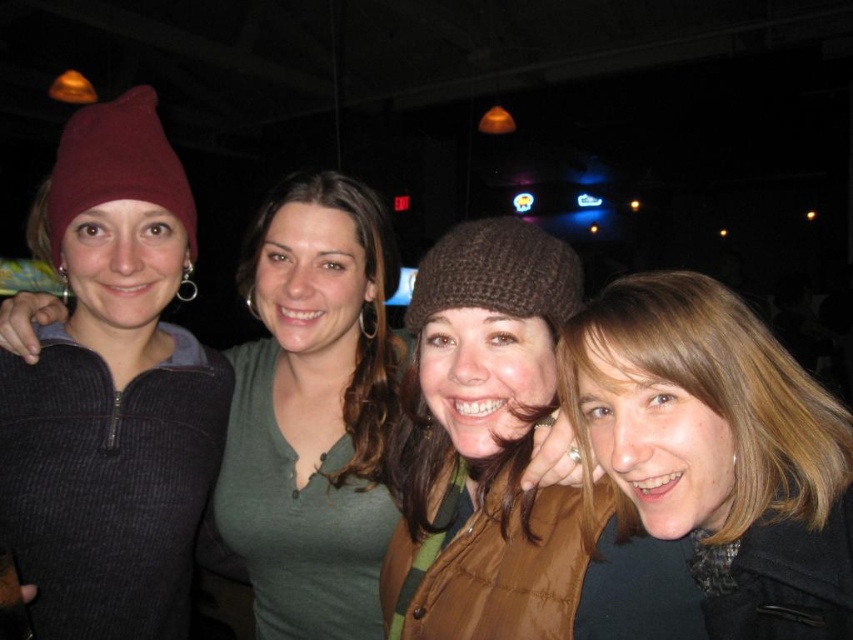
Image resolution: width=853 pixels, height=640 pixels. I want to click on matte dark gray sweater at left, so click(x=112, y=394).

Between point (97, 608) and point (842, 515), which one is positioned in front?

Point (842, 515)

Between point (136, 596) and point (737, 380), which one is positioned behind?

The point (136, 596) is more distant.

Locate an element on the screen. This screenshot has height=640, width=853. matte dark gray sweater at left is located at coordinates (112, 394).

Does blonde hair at center appear under maroon knit beanie at left?

Yes, blonde hair at center is below maroon knit beanie at left.

Is blonde hair at center smaller than maroon knit beanie at left?

Indeed, blonde hair at center has a smaller size compared to maroon knit beanie at left.

Between point (698, 420) and point (62, 192), which one is positioned in front?

Positioned in front is point (698, 420).

Where is `blonde hair at center`? blonde hair at center is located at coordinates (718, 451).

Between matte dark gray sweater at left and maroon knit beanie at left, which one appears on the left side from the viewer's perspective?

maroon knit beanie at left is more to the left.

Can you confirm if matte dark gray sweater at left is positioned to the right of maroon knit beanie at left?

Indeed, matte dark gray sweater at left is positioned on the right side of maroon knit beanie at left.

Does point (97, 449) come closer to viewer compared to point (56, 253)?

Yes.

Where is `matte dark gray sweater at left`? This screenshot has height=640, width=853. matte dark gray sweater at left is located at coordinates (112, 394).